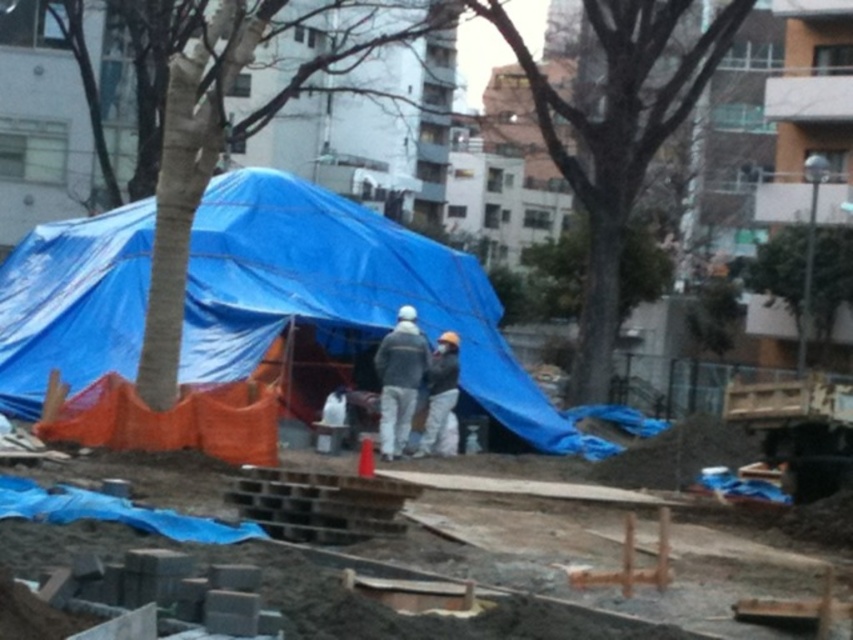
Question: From the image, what is the correct spatial relationship of smooth bark tree at center in relation to gray fabric worker at center?

Choices:
 (A) below
 (B) above

Answer: (B)

Question: Which of these objects is positioned farthest from the gray fabric worker at center?

Choices:
 (A) green leafy tree at upper center
 (B) gray fabric jacket at center

Answer: (A)

Question: Is smooth bark tree at center thinner than gray fabric worker at center?

Choices:
 (A) yes
 (B) no

Answer: (B)

Question: Which object is positioned closest to the green leafy tree at upper center?

Choices:
 (A) smooth bark tree at center
 (B) blue tarpaulin tent at center
 (C) gray fabric worker at center
 (D) gray fabric jacket at center

Answer: (A)

Question: Does smooth bark tree at center have a greater width compared to gray fabric worker at center?

Choices:
 (A) yes
 (B) no

Answer: (A)

Question: Which object appears closest to the camera in this image?

Choices:
 (A) gray fabric worker at center
 (B) smooth bark tree at center
 (C) green leafy tree at upper center

Answer: (A)